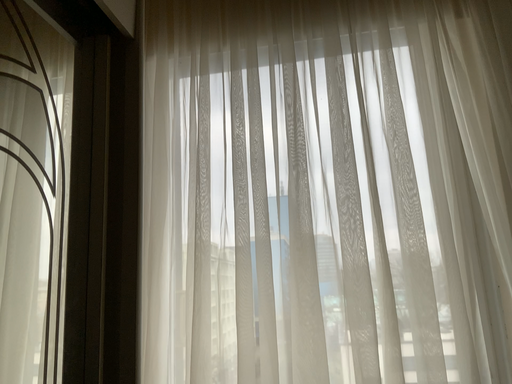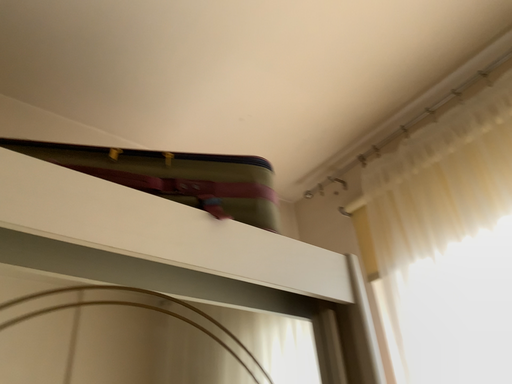
Question: How did the camera likely rotate when shooting the video?

Choices:
 (A) rotated upward
 (B) rotated downward

Answer: (A)